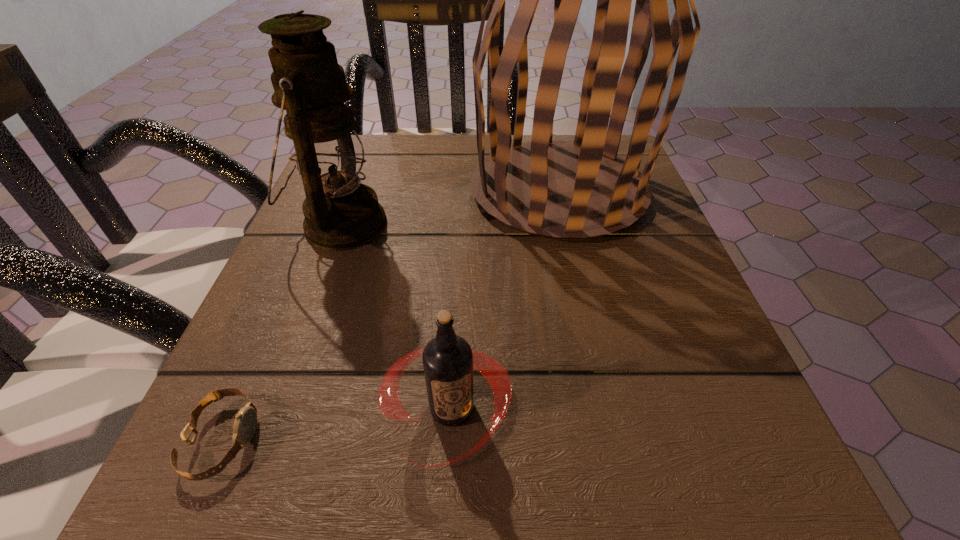
Identify the location of vacant region at the right edge. The image size is (960, 540). (603, 318).

This screenshot has width=960, height=540. In the image, there is a desktop. Identify the location of vacant space at the far left corner. (405, 147).

In the image, there is a desktop. Identify the location of free region at the near left corner. (252, 451).

I want to click on free spot between the oil lamp and the tallest object, so click(449, 207).

Where is `free space between the shortest object and the birdcage`? The height and width of the screenshot is (540, 960). free space between the shortest object and the birdcage is located at coordinates (391, 315).

Identify the location of vacant point located between the root beer and the watch. (337, 424).

Image resolution: width=960 pixels, height=540 pixels. Find the location of `free space between the second shortest object and the tallest object`. free space between the second shortest object and the tallest object is located at coordinates point(505,300).

The height and width of the screenshot is (540, 960). I want to click on free spot between the root beer and the tallest object, so click(505, 300).

The image size is (960, 540). I want to click on free space between the watch and the second tallest object, so click(282, 332).

Find the location of `free space between the second tallest object and the third tallest object`. free space between the second tallest object and the third tallest object is located at coordinates (396, 317).